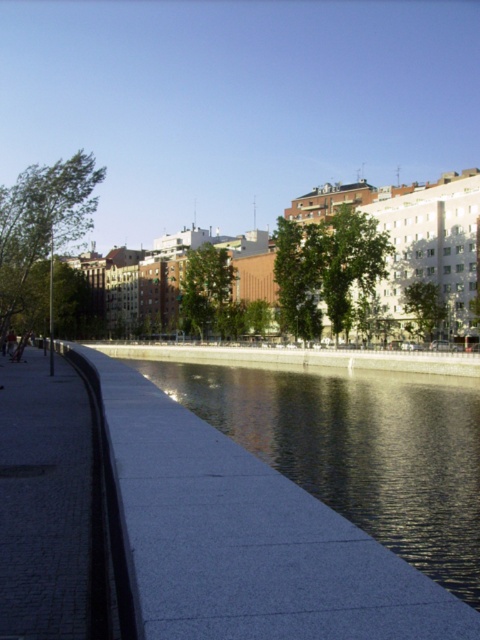
Question: Can you confirm if smooth concrete river at lower center is positioned to the right of gray concrete pavement at lower left?

Choices:
 (A) yes
 (B) no

Answer: (A)

Question: Which point appears farthest from the camera in this image?

Choices:
 (A) (85, 436)
 (B) (171, 412)

Answer: (A)

Question: Considering the relative positions of smooth concrete river at lower center and gray concrete pavement at lower left in the image provided, where is smooth concrete river at lower center located with respect to gray concrete pavement at lower left?

Choices:
 (A) right
 (B) left

Answer: (A)

Question: Which point is farther from the camera taking this photo?

Choices:
 (A) (1, 620)
 (B) (393, 636)

Answer: (A)

Question: Is smooth concrete river at lower center bigger than gray concrete pavement at lower left?

Choices:
 (A) no
 (B) yes

Answer: (B)

Question: Which object is closer to the camera taking this photo?

Choices:
 (A) gray concrete pavement at lower left
 (B) smooth concrete river at lower center

Answer: (B)